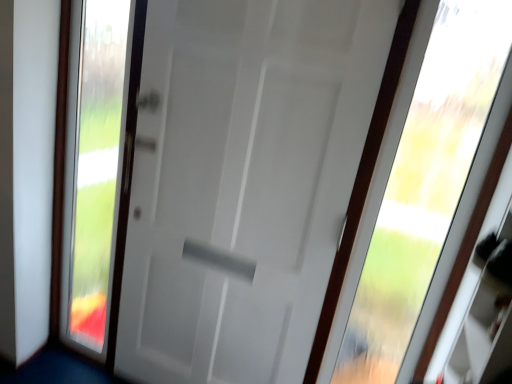
Question: Does transparent glass door at left turn towards white matte door at center?

Choices:
 (A) no
 (B) yes

Answer: (A)

Question: From the image's perspective, is transparent glass door at left beneath white matte door at center?

Choices:
 (A) yes
 (B) no

Answer: (B)

Question: Is the position of transparent glass door at left less distant than that of white matte door at center?

Choices:
 (A) no
 (B) yes

Answer: (A)

Question: Can you confirm if transparent glass door at left is bigger than white matte door at center?

Choices:
 (A) yes
 (B) no

Answer: (B)

Question: Considering the relative sizes of transparent glass door at left and white matte door at center in the image provided, is transparent glass door at left shorter than white matte door at center?

Choices:
 (A) yes
 (B) no

Answer: (A)

Question: From a real-world perspective, is transparent glass door at left positioned over white matte door at center based on gravity?

Choices:
 (A) no
 (B) yes

Answer: (A)

Question: Is the position of transparent glass door at left more distant than that of transparent glass window at upper right?

Choices:
 (A) yes
 (B) no

Answer: (A)

Question: Considering the relative positions of transparent glass door at left and transparent glass window at upper right in the image provided, is transparent glass door at left to the left of transparent glass window at upper right from the viewer's perspective?

Choices:
 (A) yes
 (B) no

Answer: (A)

Question: Can you confirm if transparent glass door at left is smaller than transparent glass window at upper right?

Choices:
 (A) no
 (B) yes

Answer: (A)

Question: Can you confirm if transparent glass door at left is thinner than transparent glass window at upper right?

Choices:
 (A) yes
 (B) no

Answer: (A)

Question: Is transparent glass window at upper right surrounded by transparent glass door at left?

Choices:
 (A) yes
 (B) no

Answer: (B)

Question: Is transparent glass door at left far from transparent glass window at upper right?

Choices:
 (A) yes
 (B) no

Answer: (A)

Question: Is transparent glass window at upper right smaller than transparent glass door at left?

Choices:
 (A) no
 (B) yes

Answer: (B)